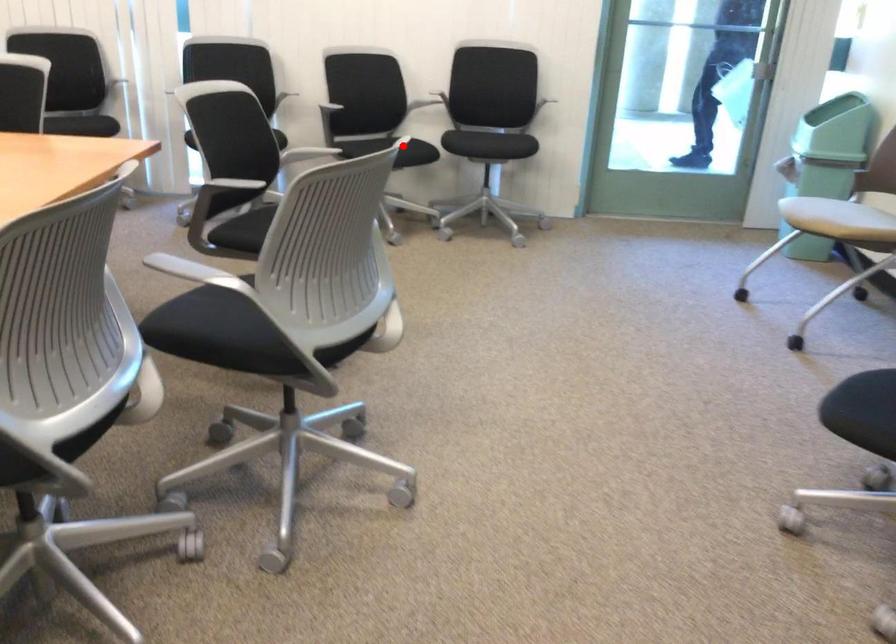
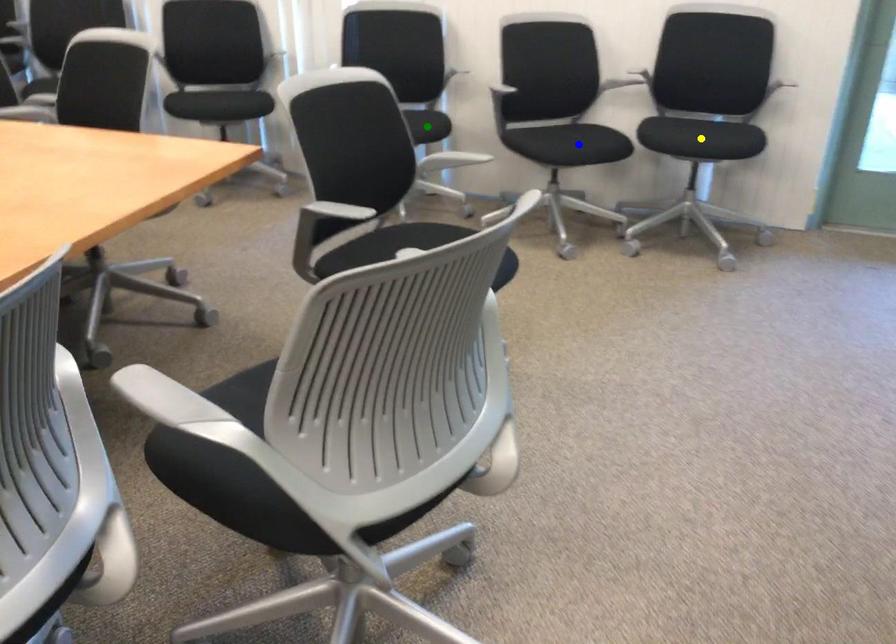
Question: I am providing you with two images of the same scene from different viewpoints. A red point is marked on the first image. You are given multiple points on the second image. Which mark in image 2 goes with the point in image 1?

Choices:
 (A) green point
 (B) yellow point
 (C) blue point

Answer: (C)